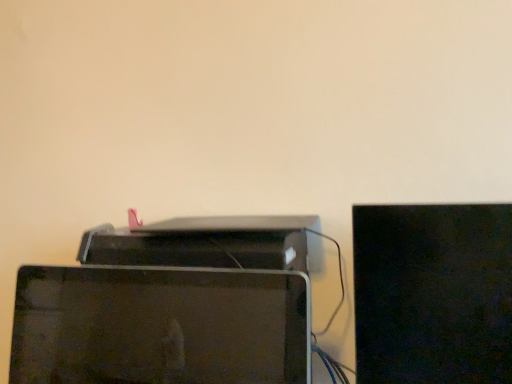
Question: Should I look upward or downward to see matte black monitor at center?

Choices:
 (A) up
 (B) down

Answer: (B)